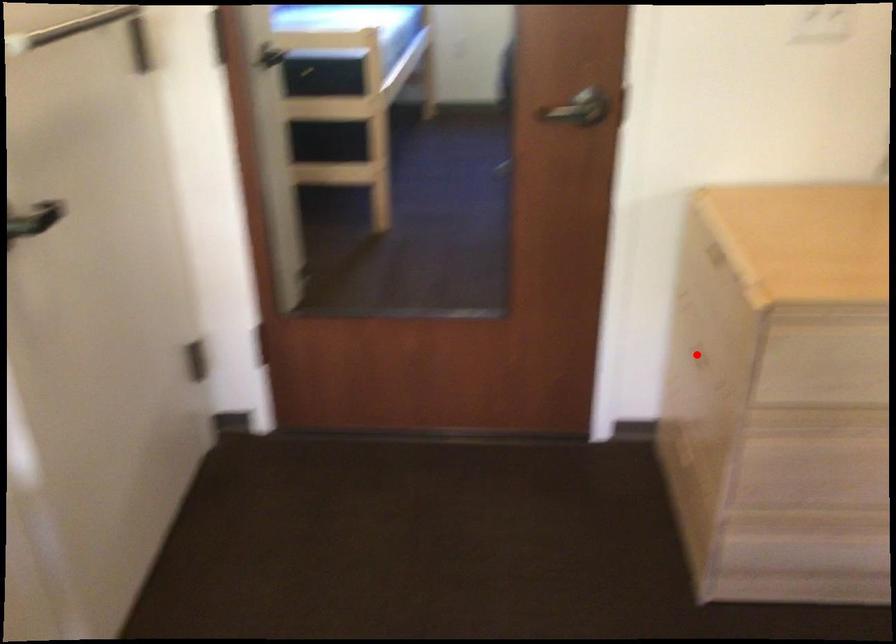
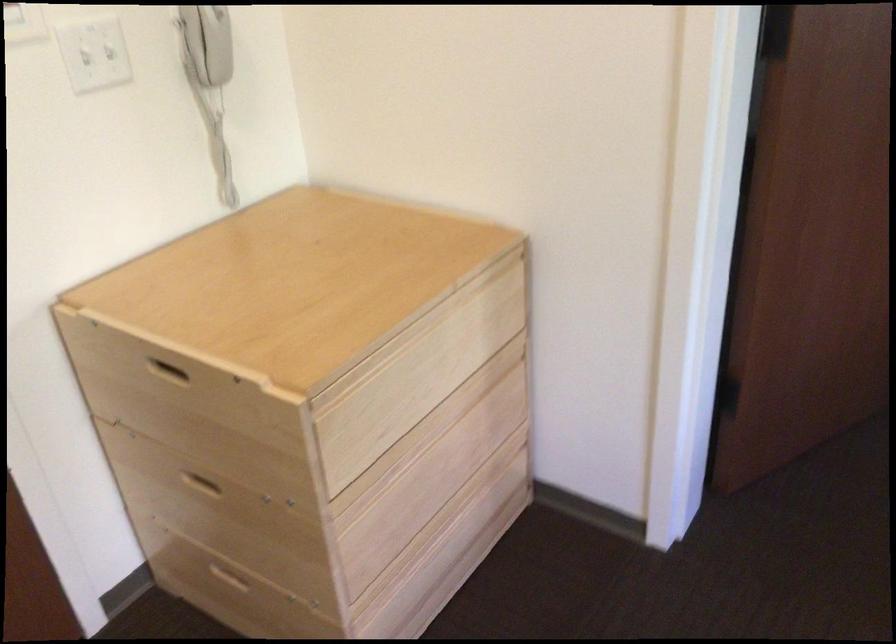
Question: I am providing you with two images of the same scene from different viewpoints. In image1, a red point is highlighted. Considering the same 3D point in image2, which of the following is correct?

Choices:
 (A) It is closer
 (B) It is farther

Answer: (A)